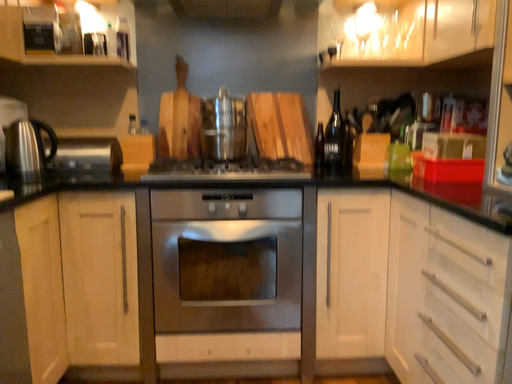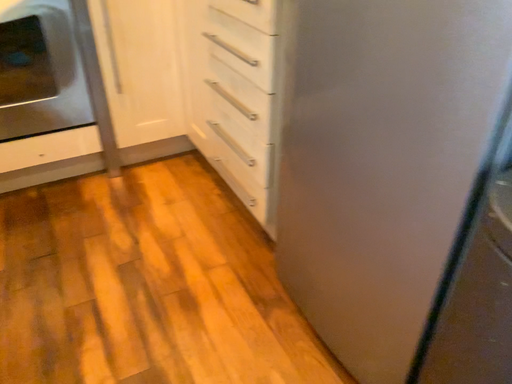
Question: Which way did the camera rotate in the video?

Choices:
 (A) rotated upward
 (B) rotated downward

Answer: (B)